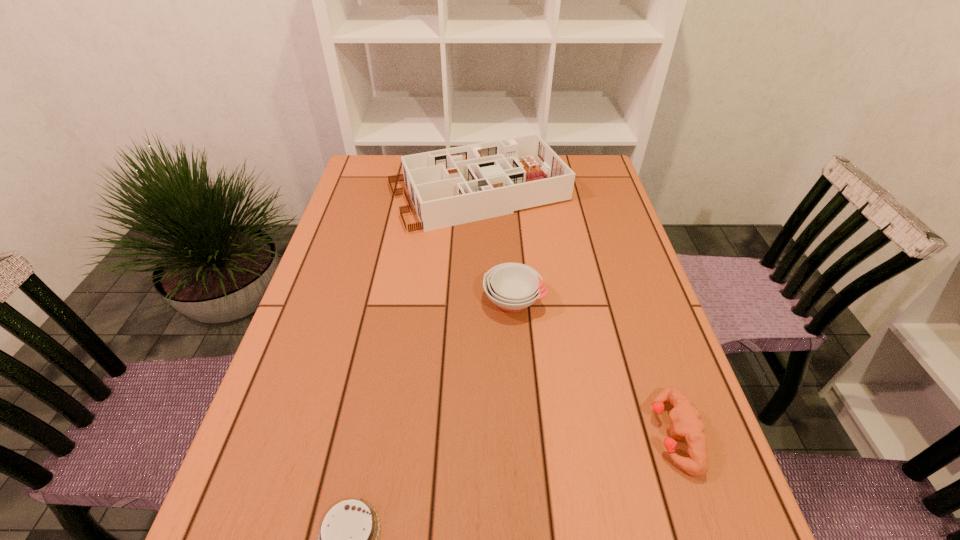
This screenshot has height=540, width=960. Find the location of `dollhouse`. dollhouse is located at coordinates (453, 186).

What are the coordinates of `the tallest object` in the screenshot? It's located at (453, 186).

Find the location of a particular element. This screenshot has height=540, width=960. the third nearest object is located at coordinates (513, 287).

Where is `the third farthest object`? The width and height of the screenshot is (960, 540). the third farthest object is located at coordinates (686, 421).

Find the location of `puncher`. puncher is located at coordinates (686, 421).

Locate an element on the screen. The width and height of the screenshot is (960, 540). vacant space located 0.160m on the front of the dollhouse is located at coordinates (479, 274).

Identify the location of free space located on the front of the third nearest object. (521, 401).

Identify the location of free space located 0.070m with the gloves of the rightmost object facing forward. (615, 434).

Identify the location of free space located 0.190m with the gloves of the rightmost object facing forward. (551, 434).

This screenshot has width=960, height=540. What are the coordinates of `vacant space positioned with the gloves of the rightmost object facing forward` in the screenshot? It's located at (605, 434).